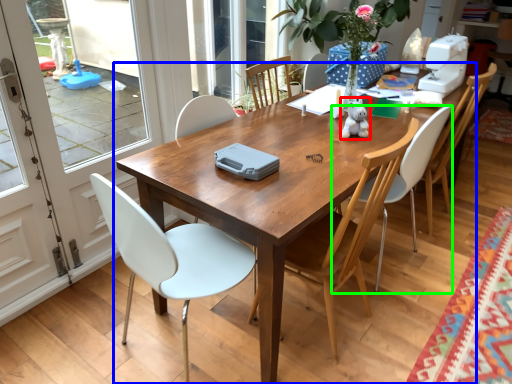
Question: Which is nearer to the toy (highlighted by a red box)? kitchen & dining room table (highlighted by a blue box) or chair (highlighted by a green box).

Choices:
 (A) kitchen & dining room table
 (B) chair

Answer: (B)